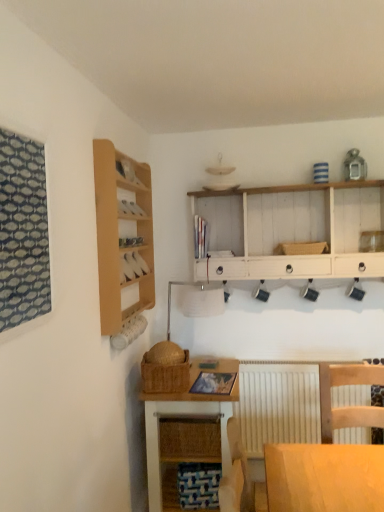
Question: From the image's perspective, is white painted wood shelf at upper center positioned above or below patterned fabric window at left?

Choices:
 (A) above
 (B) below

Answer: (A)

Question: Would you say white painted wood shelf at upper center is to the left or to the right of patterned fabric window at left in the picture?

Choices:
 (A) right
 (B) left

Answer: (A)

Question: Which of these objects is positioned closest to the white painted wood shelf at upper center?

Choices:
 (A) light wood shelf at left
 (B) woven brown basket at lower center, marked as the 2th basket in a right-to-left arrangement
 (C) woven wood desk at lower center
 (D) patterned fabric window at left
 (E) wooden chair at lower right

Answer: (A)

Question: Which object is positioned farthest from the woven brown basket at lower center, which is the 1th basket from left to right?

Choices:
 (A) patterned fabric window at left
 (B) white matte radiator at lower center
 (C) woven straw basket at center, which is the 1th basket in back-to-front order
 (D) woven wood desk at lower center
 (E) wooden chair at lower right

Answer: (A)